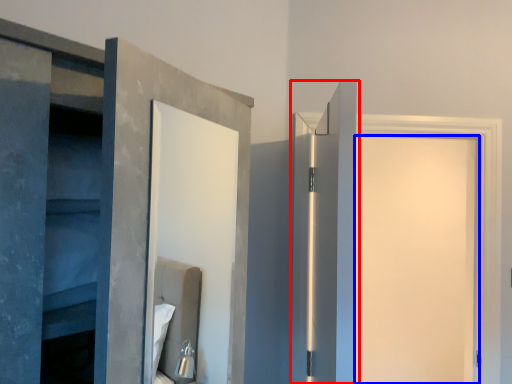
Question: Which object is closer to the camera taking this photo, door (highlighted by a red box) or door (highlighted by a blue box)?

Choices:
 (A) door
 (B) door

Answer: (A)